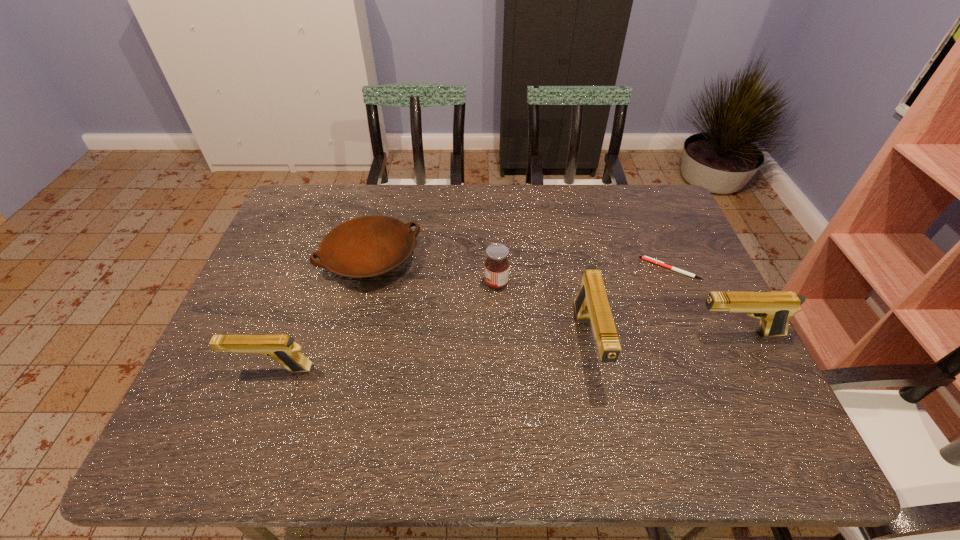
Where is `pistol that is at the right edge`? This screenshot has width=960, height=540. pistol that is at the right edge is located at coordinates (774, 309).

This screenshot has width=960, height=540. I want to click on pen positioned at the right edge, so click(x=646, y=258).

This screenshot has height=540, width=960. I want to click on free region at the far edge of the desktop, so click(584, 219).

Find the location of a particular element. The width and height of the screenshot is (960, 540). vacant area at the left edge of the desktop is located at coordinates (285, 241).

Locate an element on the screen. The width and height of the screenshot is (960, 540). vacant space at the far left corner is located at coordinates tap(314, 196).

Where is `vacant space at the near left corner of the desktop`? The image size is (960, 540). vacant space at the near left corner of the desktop is located at coordinates (252, 396).

At what (x,y) coordinates should I click in order to perform the action: click on free region at the far right corner of the desktop. Please return your answer as a coordinate pair (x, y). The width and height of the screenshot is (960, 540). Looking at the image, I should click on (671, 218).

What are the coordinates of `vacant area between the shortest object and the second tallest object` in the screenshot? It's located at (704, 301).

Identify the location of free space between the shortest pistol and the third object from left to right. Image resolution: width=960 pixels, height=540 pixels. (384, 326).

Identify the location of unoccupied area between the jam and the shortest pistol. The height and width of the screenshot is (540, 960). (384, 326).